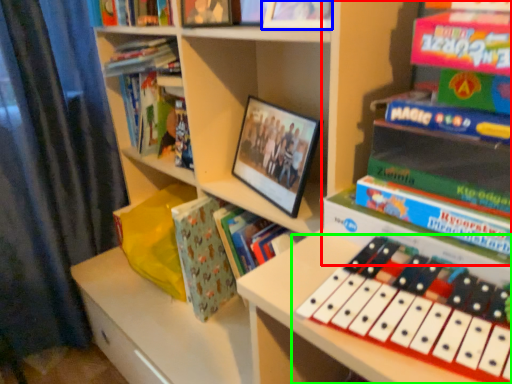
Question: Based on their relative distances, which object is farther from book (highlighted by a red box)? Choose from book (highlighted by a blue box) and musical keyboard (highlighted by a green box).

Choices:
 (A) book
 (B) musical keyboard

Answer: (B)